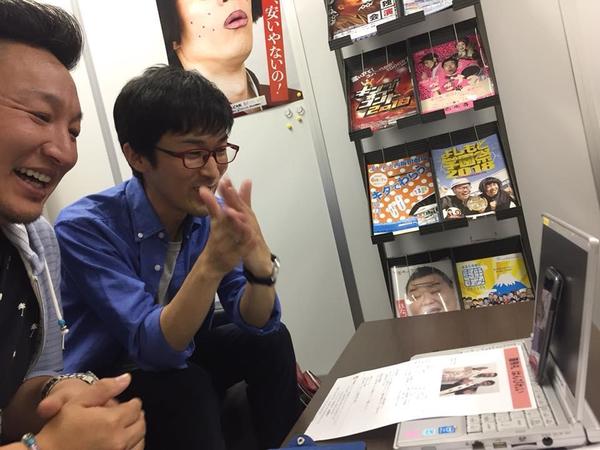
You are a GUI agent. You are given a task and a screenshot of the screen. Output one action in this format:
    pyautogui.click(x=<x>, y=<y>)
    Task: Click on the table
    The image size is (600, 450).
    Given the screenshot: What is the action you would take?
    pyautogui.click(x=454, y=321)